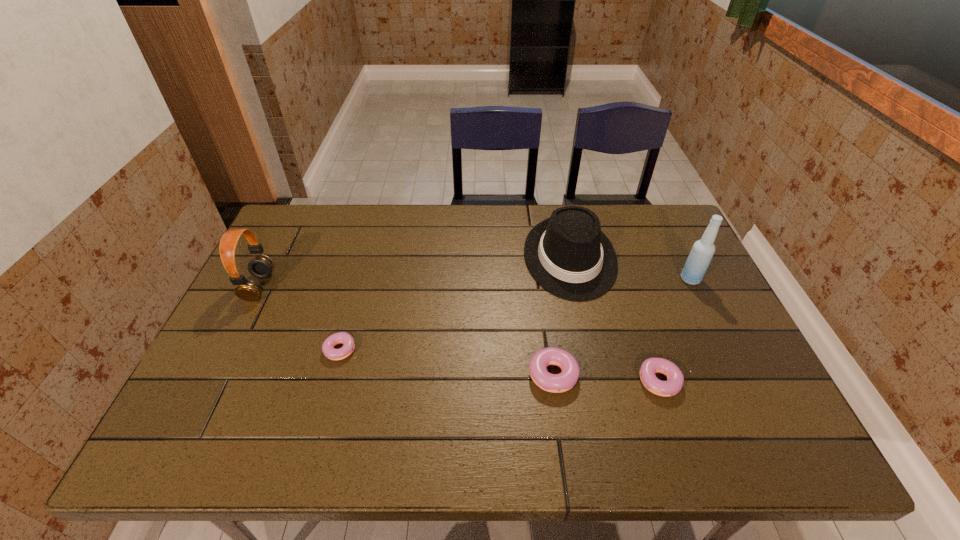
At what (x,y) coordinates should I click in order to perform the action: click on the rightmost object. Please return your answer as a coordinate pair (x, y). Looking at the image, I should click on (698, 261).

At what (x,y) coordinates should I click in order to perform the action: click on free space located on the right of the leftmost doughnut. Please return your answer as a coordinate pair (x, y). Looking at the image, I should click on (419, 350).

Find the location of a particular element. The image size is (960, 540). vacant space located on the back of the tallest doughnut is located at coordinates (535, 246).

You are a GUI agent. You are given a task and a screenshot of the screen. Output one action in this format:
    pyautogui.click(x=<x>, y=<y>)
    Task: Click on the blank space located on the left of the rightmost doughnut
    
    Given the screenshot: What is the action you would take?
    pyautogui.click(x=618, y=381)

Where is `free space located on the ear cups of the leftmost object`? Image resolution: width=960 pixels, height=540 pixels. free space located on the ear cups of the leftmost object is located at coordinates (323, 287).

Find the location of `vacant region located on the front-facing side of the fourth shortest object`. vacant region located on the front-facing side of the fourth shortest object is located at coordinates (589, 345).

Where is `blank area located 0.320m on the back of the bottle`? This screenshot has height=540, width=960. blank area located 0.320m on the back of the bottle is located at coordinates (657, 210).

This screenshot has height=540, width=960. Identify the location of object located at the far edge. (567, 254).

What are the coordinates of `object at the left edge` in the screenshot? It's located at (261, 266).

Find the location of `object positioned at the right edge`. object positioned at the right edge is located at coordinates (698, 261).